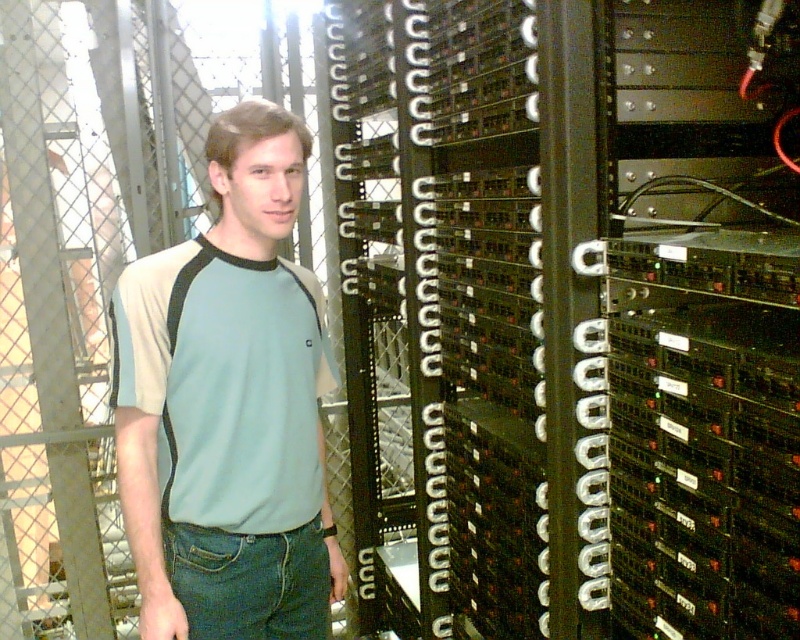
Does black metal server rack at center have a smaller size compared to light blue cotton t-shirt at center?

No.

Does black metal server rack at center lie behind light blue cotton t-shirt at center?

No, black metal server rack at center is closer to the viewer.

Is point (630, 115) closer to camera compared to point (276, 445)?

Yes.

The width and height of the screenshot is (800, 640). Identify the location of black metal server rack at center. 572,316.